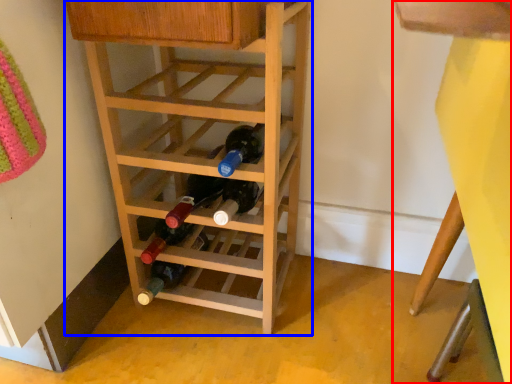
Question: Which object appears farthest to the camera in this image, bunk bed (highlighted by a red box) or shelf (highlighted by a blue box)?

Choices:
 (A) bunk bed
 (B) shelf

Answer: (B)